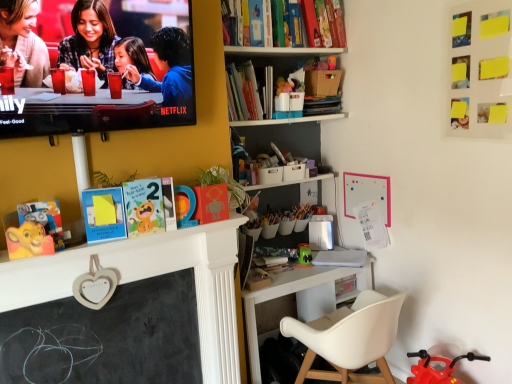
You are a GUI agent. You are given a task and a screenshot of the screen. Output one action in this format:
    pyautogui.click(x=<x>, y=<y>)
    Task: Click on the vacant space situated on the left part of white paper at desk center, the 3th book from the top
    This screenshot has width=512, height=384.
    Given the screenshot: What is the action you would take?
    pyautogui.click(x=308, y=267)